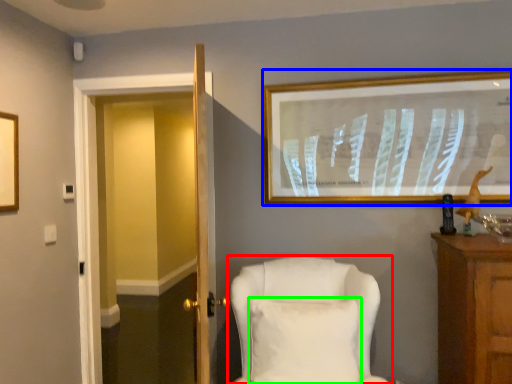
Question: Estimate the real-world distances between objects in this image. Which object is closer to chair (highlighted by a red box), picture frame (highlighted by a blue box) or pillow (highlighted by a green box)?

Choices:
 (A) picture frame
 (B) pillow

Answer: (B)